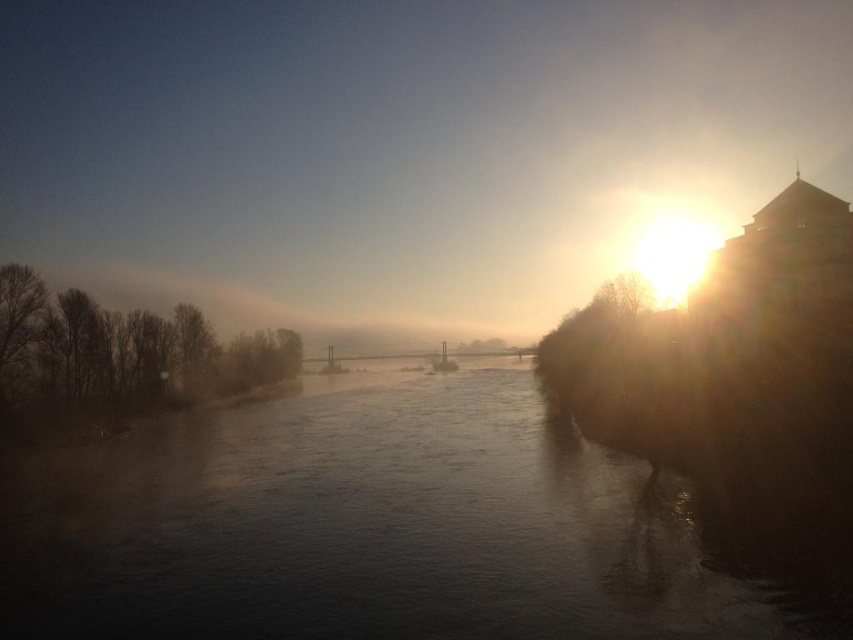
From the picture: You are standing at the point with coordinates point (396,44) and want to walk towards the point with coordinates point (688,541). Is there any obstruction between you and your destination?

Point (396,44) is behind point (688,541), so there is an obstruction between them. You cannot walk directly towards the point (688,541) without going around.

You are an artist trying to paint the riverside scene. You want to depict the dark water at center and the foggy mist at river center accurately. Which object should you paint first to ensure proper layering?

The foggy mist at river center should be painted first because the dark water at center is behind it, so layering the mist over the water would create the correct visual depth.